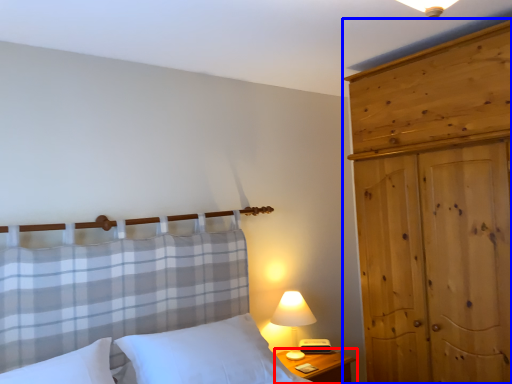
Question: Which object is closer to the camera taking this photo, nightstand (highlighted by a red box) or dresser (highlighted by a blue box)?

Choices:
 (A) nightstand
 (B) dresser

Answer: (B)